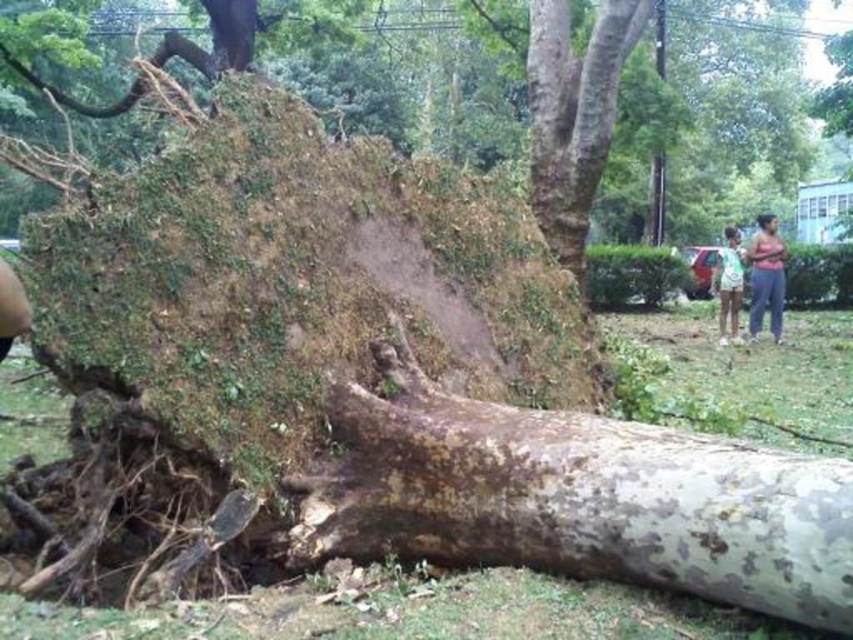
Does speckled bark tree trunk at center have a lesser height compared to brown rough bark tree trunk at upper center?

Yes, speckled bark tree trunk at center is shorter than brown rough bark tree trunk at upper center.

Is point (498, 476) in front of point (589, 163)?

Yes, it is in front of point (589, 163).

At what (x,y) coordinates should I click in order to perform the action: click on speckled bark tree trunk at center. Please return your answer as a coordinate pair (x, y). The image size is (853, 640). Looking at the image, I should click on (575, 497).

Can you confirm if speckled bark tree trunk at center is wider than pink fabric shirt at right?

Yes.

Does speckled bark tree trunk at center appear under pink fabric shirt at right?

Correct, speckled bark tree trunk at center is located below pink fabric shirt at right.

I want to click on speckled bark tree trunk at center, so click(x=575, y=497).

Can you confirm if speckled bark tree trunk at center is positioned below green fabric shirt at right?

Yes.

Based on the photo, does speckled bark tree trunk at center appear on the left side of green fabric shirt at right?

Indeed, speckled bark tree trunk at center is positioned on the left side of green fabric shirt at right.

Is point (730, 458) positioned after point (737, 257)?

No, (730, 458) is closer to viewer.

Locate an element on the screen. The height and width of the screenshot is (640, 853). speckled bark tree trunk at center is located at coordinates (575, 497).